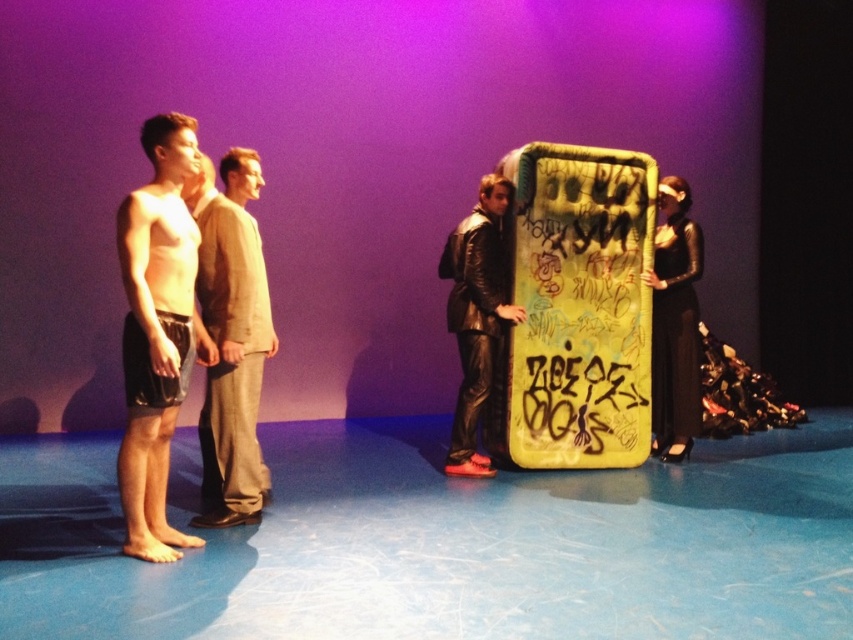
Can you confirm if beige fabric pants at center is positioned to the right of leather jacket at center?

No, beige fabric pants at center is not to the right of leather jacket at center.

Who is more forward, (256, 465) or (476, 241)?

Positioned in front is point (256, 465).

Where is `beige fabric pants at center`? beige fabric pants at center is located at coordinates (231, 346).

Where is `beige fabric pants at center`? beige fabric pants at center is located at coordinates (231, 346).

Looking at this image, does leather jacket at center have a larger size compared to black leather dress at right?

No, leather jacket at center is not bigger than black leather dress at right.

Consider the image. Can you confirm if leather jacket at center is positioned to the right of black leather dress at right?

No, leather jacket at center is not to the right of black leather dress at right.

The image size is (853, 640). Describe the element at coordinates (479, 320) in the screenshot. I see `leather jacket at center` at that location.

Find the location of `leather jacket at center`. leather jacket at center is located at coordinates (479, 320).

Can you confirm if shiny black shorts at left is positioned to the left of beige fabric pants at center?

Correct, you'll find shiny black shorts at left to the left of beige fabric pants at center.

Between point (154, 260) and point (207, 186), which one is positioned in front?

Point (154, 260) is more forward.

Identify the location of shiny black shorts at left. The image size is (853, 640). (157, 332).